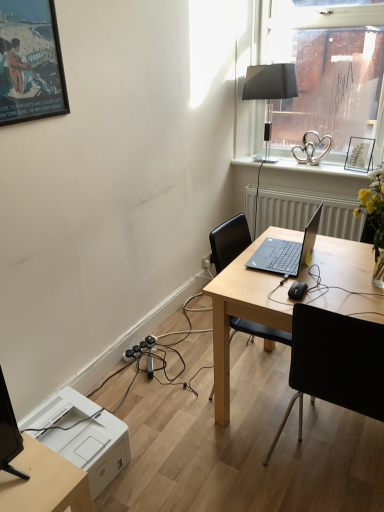
The height and width of the screenshot is (512, 384). In order to click on vacant space that is in between black plastic mouse at lower right and sleek black laptop at center in this screenshot , I will do `click(302, 278)`.